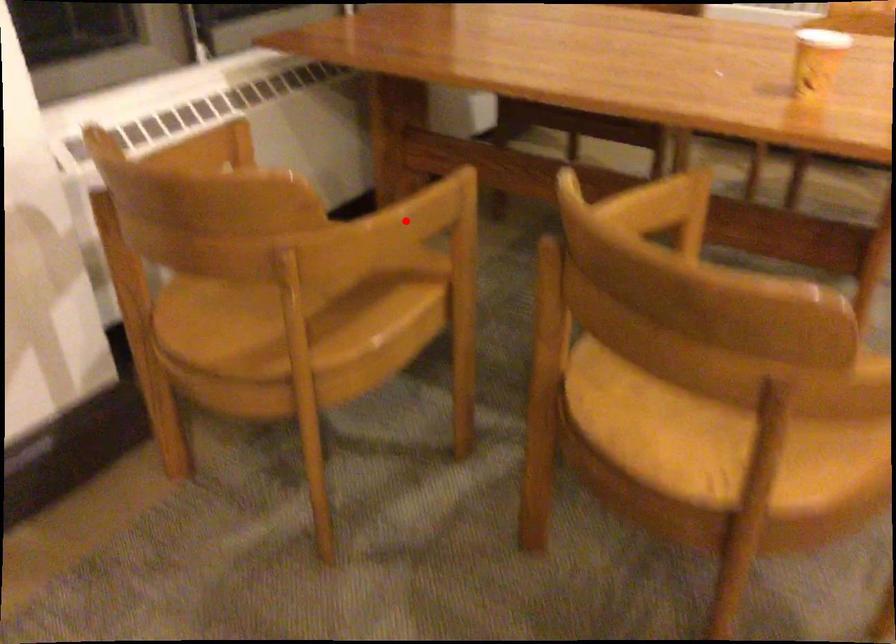
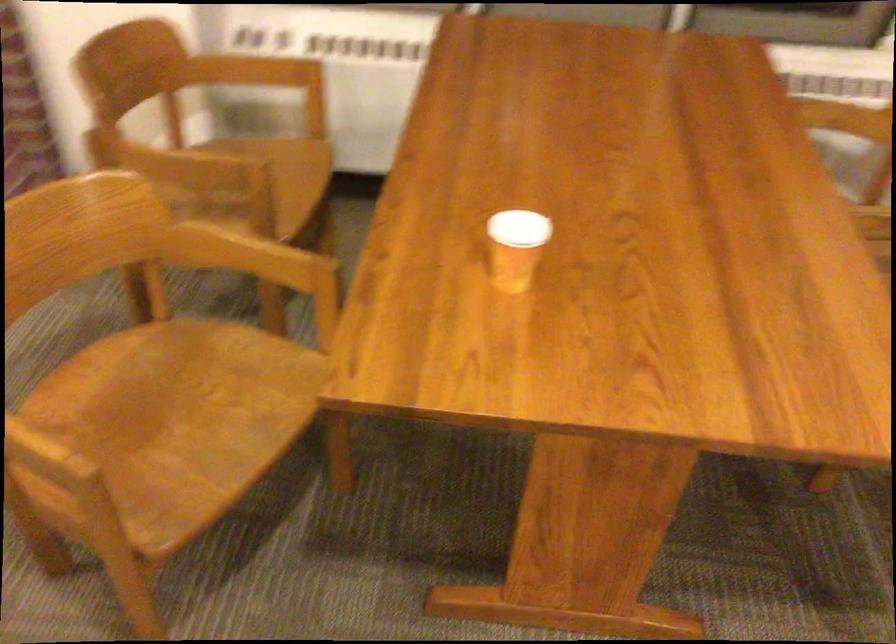
Question: A red point is marked in image1. In image2, is the corresponding 3D point closer to the camera or farther? Reply with the corresponding letter.

Choices:
 (A) The corresponding 3D point is closer.
 (B) The corresponding 3D point is farther.

Answer: (B)